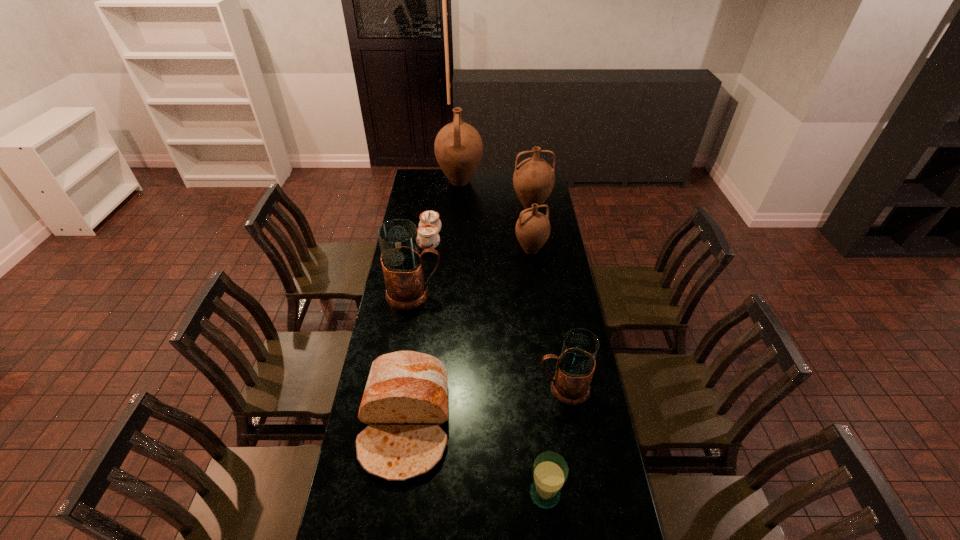
At what (x,y) coordinates should I click in order to perform the action: click on the farthest brown pitcher. Please return your answer as a coordinate pair (x, y). Looking at the image, I should click on (458, 146).

Where is `the farthest object`? This screenshot has height=540, width=960. the farthest object is located at coordinates (458, 146).

Image resolution: width=960 pixels, height=540 pixels. In order to click on the second farthest pitcher in this screenshot , I will do `click(533, 179)`.

Where is `the second nearest brown pitcher`? Image resolution: width=960 pixels, height=540 pixels. the second nearest brown pitcher is located at coordinates (533, 179).

Image resolution: width=960 pixels, height=540 pixels. Find the location of `the second nearest pitcher`. the second nearest pitcher is located at coordinates (402, 265).

You are a GUI agent. You are given a task and a screenshot of the screen. Output one action in this format:
    pyautogui.click(x=<x>, y=<y>)
    Task: Click on the fifth farthest object
    
    Given the screenshot: What is the action you would take?
    pyautogui.click(x=402, y=265)

Where is `the nearest brown pitcher`? The image size is (960, 540). the nearest brown pitcher is located at coordinates (532, 229).

Locate an element on the screen. the smallest brown pitcher is located at coordinates (532, 229).

Identify the location of the nearest pitcher. (574, 369).

Locate an element on the screen. the right gray pitcher is located at coordinates (574, 369).